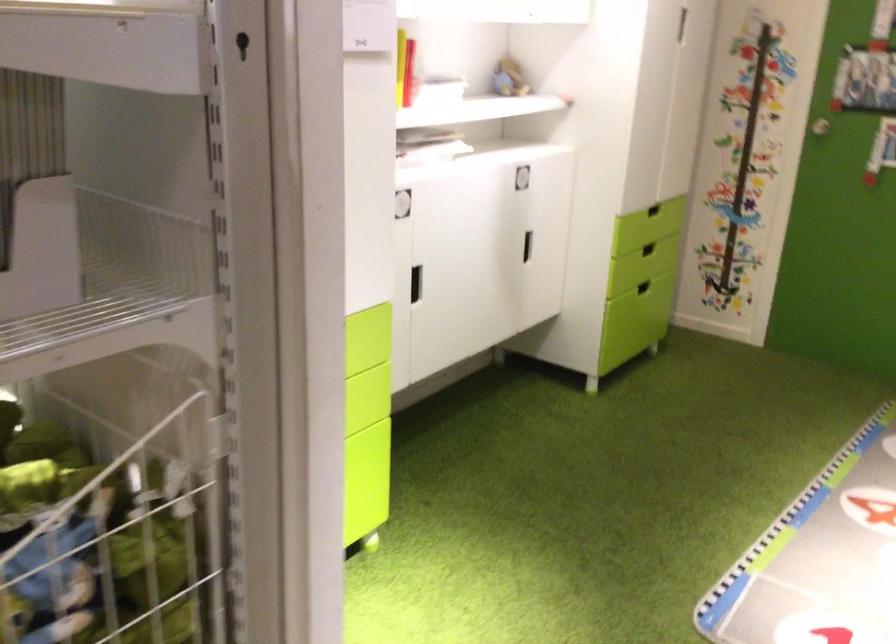
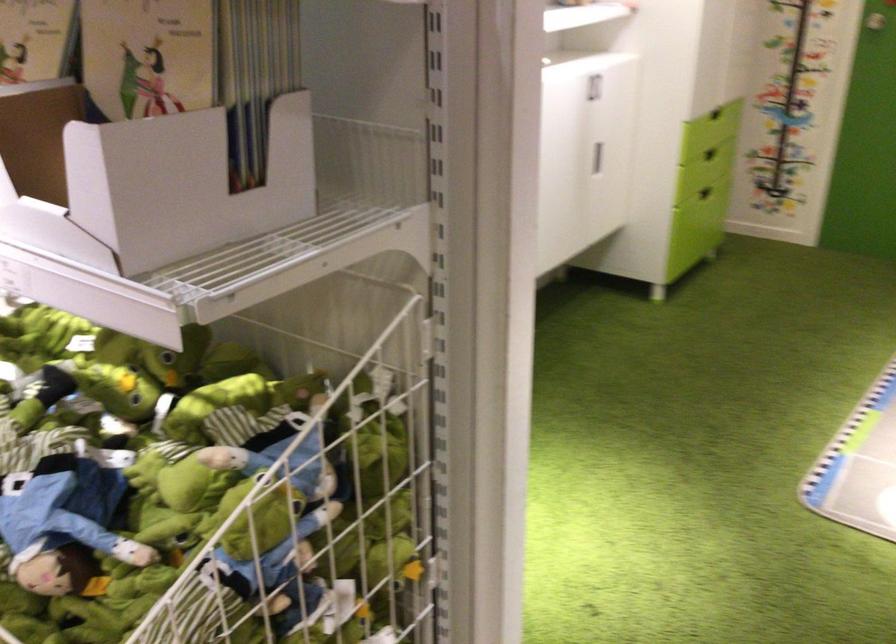
Locate, in the second image, the point that corresponds to pixel 526 249 in the first image.

(597, 158)